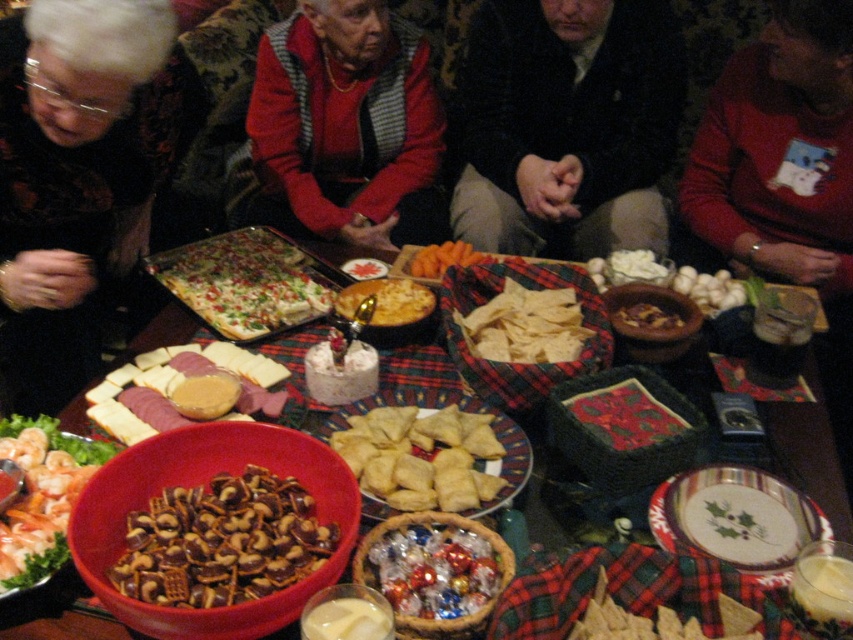
Is dark brown leather jacket at center behind shiny foil-wrapped candies at center?

Yes, dark brown leather jacket at center is further from the viewer.

Is point (540, 115) closer to camera compared to point (469, 589)?

No, it is not.

Is point (537, 227) closer to camera compared to point (450, 564)?

That is False.

The image size is (853, 640). I want to click on dark brown leather jacket at center, so click(x=567, y=125).

This screenshot has height=640, width=853. I want to click on matte brown chips at lower center, so click(x=659, y=620).

Between matte brown chips at lower center and orange carrot at center, which one appears on the right side from the viewer's perspective?

matte brown chips at lower center is more to the right.

In order to click on matte brown chips at lower center in this screenshot , I will do `click(659, 620)`.

I want to click on matte brown chips at lower center, so (x=659, y=620).

Is black fabric at upper left shorter than white cheese at center?

In fact, black fabric at upper left may be taller than white cheese at center.

Consider the image. Does black fabric at upper left lie behind white cheese at center?

No.

Is point (10, 44) farther from viewer compared to point (271, 406)?

Yes.

Find the location of a particular element. Image resolution: width=853 pixels, height=640 pixels. black fabric at upper left is located at coordinates (80, 176).